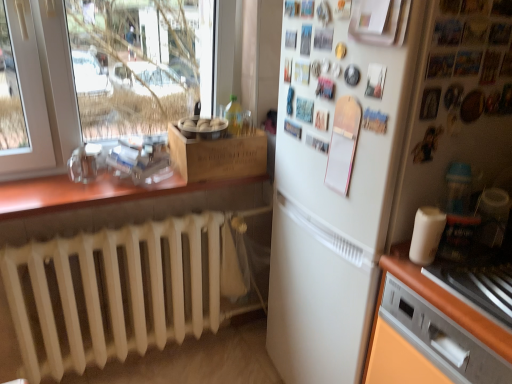
Describe the element at coordinates (372, 155) in the screenshot. The height and width of the screenshot is (384, 512). I see `white matte refrigerator at center` at that location.

Find the location of a particular element. This screenshot has width=512, height=384. white matte cup at right is located at coordinates (426, 235).

Describe the element at coordinates (106, 188) in the screenshot. Image resolution: width=512 pixels, height=384 pixels. I see `brown wood countertop at left` at that location.

What do you see at coordinates (430, 332) in the screenshot? The height and width of the screenshot is (384, 512). I see `metallic silver dishwasher at lower right` at bounding box center [430, 332].

Identify the location of metallic silver dishwasher at lower right. This screenshot has height=384, width=512. (430, 332).

Identify the location of white matte radiator at lower left. This screenshot has height=384, width=512. (117, 291).

What is the approximate height of wooden crate at center?

It is 6.27 inches.

The width and height of the screenshot is (512, 384). What do you see at coordinates (218, 156) in the screenshot?
I see `wooden crate at center` at bounding box center [218, 156].

Identify the location of white matte refrigerator at center. The height and width of the screenshot is (384, 512). (372, 155).

How different are the orientations of metallic silver dishwasher at lower right and brown wood countertop at left in degrees?

They differ by 91 degrees in their facing directions.

Is metallic silver dishwasher at lower right facing towards brown wood countertop at left?

No, metallic silver dishwasher at lower right is not oriented towards brown wood countertop at left.

Considering the sizes of objects metallic silver dishwasher at lower right and brown wood countertop at left in the image provided, who is shorter, metallic silver dishwasher at lower right or brown wood countertop at left?

With less height is brown wood countertop at left.

From the picture: Between metallic silver dishwasher at lower right and white matte refrigerator at center, which one appears on the right side from the viewer's perspective?

From the viewer's perspective, metallic silver dishwasher at lower right appears more on the right side.

From a real-world perspective, is metallic silver dishwasher at lower right positioned above or below white matte refrigerator at center?

metallic silver dishwasher at lower right is above white matte refrigerator at center.

Considering the sizes of objects metallic silver dishwasher at lower right and white matte refrigerator at center in the image provided, who is wider, metallic silver dishwasher at lower right or white matte refrigerator at center?

white matte refrigerator at center.

Measure the distance from white matte radiator at lower left to white matte refrigerator at center.

white matte radiator at lower left is 27.56 inches away from white matte refrigerator at center.

How different are the orientations of white matte radiator at lower left and white matte refrigerator at center in degrees?

The angular difference between white matte radiator at lower left and white matte refrigerator at center is 89.9 degrees.

Is white matte radiator at lower left in front of or behind white matte refrigerator at center in the image?

white matte radiator at lower left is positioned farther from the viewer than white matte refrigerator at center.

Which point is more distant from viewer, (81, 263) or (330, 23)?

Point (81, 263)

From the image's perspective, does metallic silver dishwasher at lower right appear lower than white matte radiator at lower left?

Incorrect, from the image's perspective, metallic silver dishwasher at lower right is higher than white matte radiator at lower left.

Is point (487, 319) closer to camera compared to point (177, 225)?

Yes, it is.

Considering the sizes of objects metallic silver dishwasher at lower right and white matte radiator at lower left in the image provided, who is thinner, metallic silver dishwasher at lower right or white matte radiator at lower left?

white matte radiator at lower left.

Is metallic silver dishwasher at lower right next to white matte radiator at lower left and touching it?

No.

Where is `radiator in front of the brown wood countertop at left`? This screenshot has height=384, width=512. radiator in front of the brown wood countertop at left is located at coordinates (117, 291).

Looking at this image, is brown wood countertop at left taller than white matte radiator at lower left?

No, brown wood countertop at left is not taller than white matte radiator at lower left.

Consider the image. From the image's perspective, relative to white matte radiator at lower left, is brown wood countertop at left above or below?

Clearly, from the image's perspective, brown wood countertop at left is above white matte radiator at lower left.

Could you tell me if brown wood countertop at left is turned towards white matte radiator at lower left?

No, brown wood countertop at left does not turn towards white matte radiator at lower left.

Is wooden crate at center bigger or smaller than brown wood countertop at left?

Clearly, wooden crate at center is smaller in size than brown wood countertop at left.

Is wooden crate at center far from brown wood countertop at left?

wooden crate at center is near brown wood countertop at left, not far away.

Considering their positions, is wooden crate at center located in front of or behind brown wood countertop at left?

wooden crate at center is positioned farther from the viewer than brown wood countertop at left.

From the image's perspective, which object appears higher, wooden crate at center or brown wood countertop at left?

From the image's view, wooden crate at center is above.

Find the location of `refrigerator directly beneath the brown wood countertop at left (from a real-world perspective)`. refrigerator directly beneath the brown wood countertop at left (from a real-world perspective) is located at coordinates (372, 155).

Which object is closer to the camera, white matte refrigerator at center or brown wood countertop at left?

Positioned in front is white matte refrigerator at center.

From the image's perspective, who appears lower, white matte refrigerator at center or brown wood countertop at left?

white matte refrigerator at center, from the image's perspective.

Image resolution: width=512 pixels, height=384 pixels. What are the coordinates of `countertop behind the metallic silver dishwasher at lower right` in the screenshot? It's located at (106, 188).

At what (x,y) coordinates should I click in order to perform the action: click on cabinetry on the right of white matte refrigerator at center. Please return your answer as a coordinate pair (x, y). This screenshot has height=384, width=512. Looking at the image, I should click on (430, 332).

Looking at the image, which one is located closer to white matte radiator at lower left, white matte cup at right or white matte refrigerator at center?

white matte refrigerator at center.

Looking at this image, based on their spatial positions, is white matte radiator at lower left or wooden crate at center further from brown wood countertop at left?

white matte radiator at lower left is positioned further to the anchor brown wood countertop at left.

Estimate the real-world distances between objects in this image. Which object is further from wooden crate at center, white matte refrigerator at center or white matte cup at right?

white matte cup at right.

Which object lies nearer to the anchor point metallic silver dishwasher at lower right, white matte refrigerator at center or wooden crate at center?

white matte refrigerator at center.

From the image, which object appears to be nearer to white matte radiator at lower left, white matte refrigerator at center or wooden crate at center?

wooden crate at center.

When comparing their distances from white matte radiator at lower left, does white matte refrigerator at center or white matte cup at right seem closer?

Among the two, white matte refrigerator at center is located nearer to white matte radiator at lower left.

From the image, which object appears to be nearer to brown wood countertop at left, wooden crate at center or white matte radiator at lower left?

wooden crate at center is closer to brown wood countertop at left.

Considering their positions, is metallic silver dishwasher at lower right positioned closer to brown wood countertop at left than wooden crate at center?

wooden crate at center.

The height and width of the screenshot is (384, 512). What are the coordinates of `radiator located between brown wood countertop at left and white matte cup at right in the left-right direction` in the screenshot? It's located at (117, 291).

I want to click on cardboard box located between brown wood countertop at left and white matte cup at right in the left-right direction, so click(218, 156).

This screenshot has height=384, width=512. I want to click on appliance between wooden crate at center and white matte refrigerator at center in the horizontal direction, so click(x=426, y=235).

You are a GUI agent. You are given a task and a screenshot of the screen. Output one action in this format:
    pyautogui.click(x=<x>, y=<y>)
    Task: Click on the radiator between brown wood countertop at left and white matte refrigerator at center
    
    Given the screenshot: What is the action you would take?
    pyautogui.click(x=117, y=291)